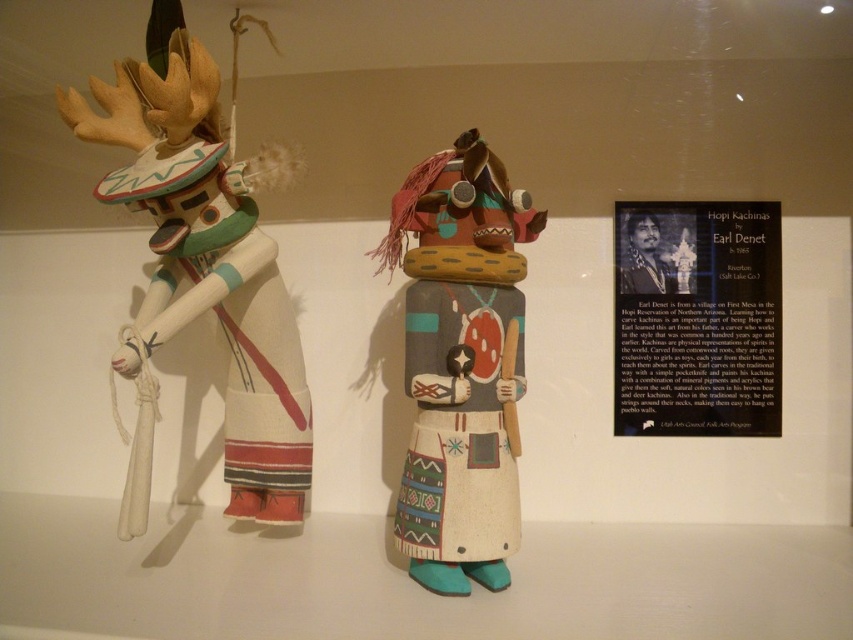
You are a museum curator arranging an exhibition. You have two Hopi Kachina dolls displayed in front of you. The matte white kachina at left and the matte painted kachina at center. Which of these dolls is taller?

The matte white kachina at left is taller than the matte painted kachina at center according to the description provided.

Consider the image. You are a visitor standing in front of the matte white kachina at left in the museum. You want to take a photo of it without getting too close. If your camera can focus on objects up to 3 feet away, will you be able to take a clear photo from your current position?

The distance between you and the matte white kachina at left is 3.30 feet, which is slightly beyond the camera maximum focus range of 3 feet. Move a little closer to ensure a clear photo.

You are a museum curator planning to place both the matte white kachina at left and the matte painted kachina at center on a shelf that can only accommodate items up to the width of the wider one. Which kachina should you place first to ensure both fit?

The matte white kachina at left is wider than the matte painted kachina at center. Place the matte white kachina at left first since it is wider, ensuring there is enough space for both on the shelf.